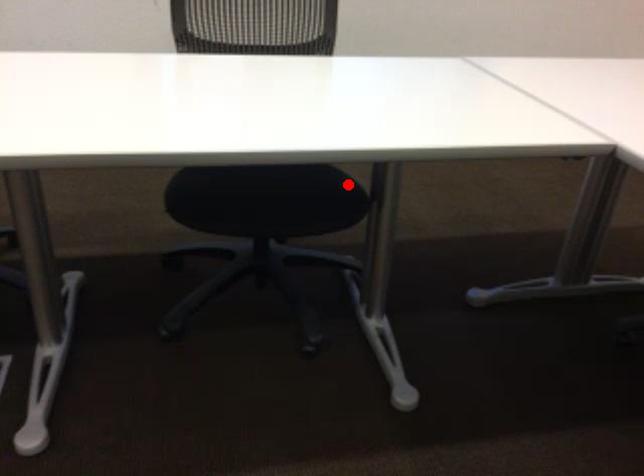
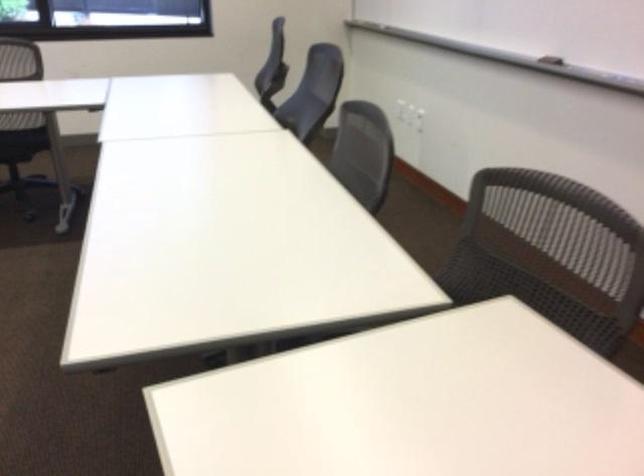
Locate, in the second image, the point that corresponds to the highlighted location in the first image.

(22, 143)